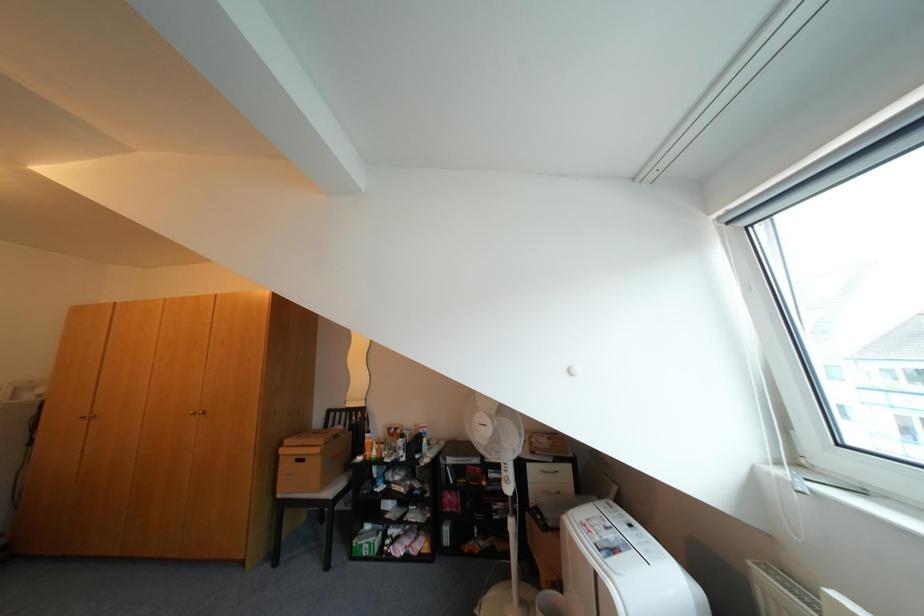
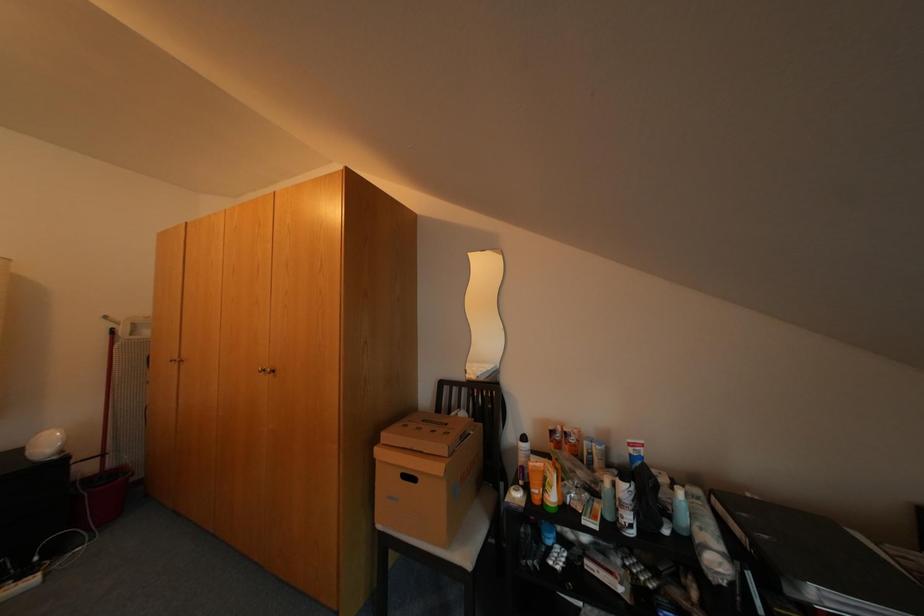
The images are taken continuously from a first-person perspective. In which direction are you moving?

The cameraman moved toward left, forward.